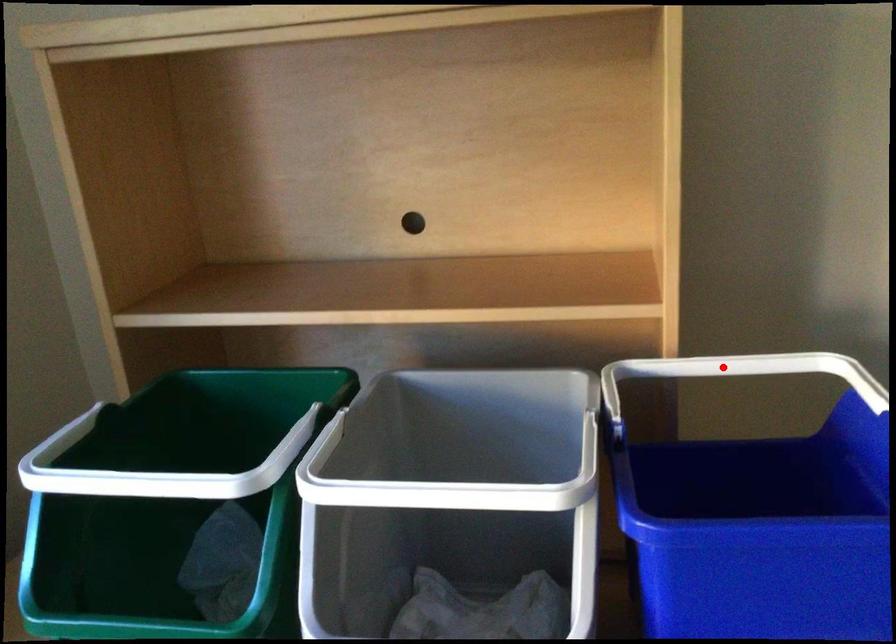
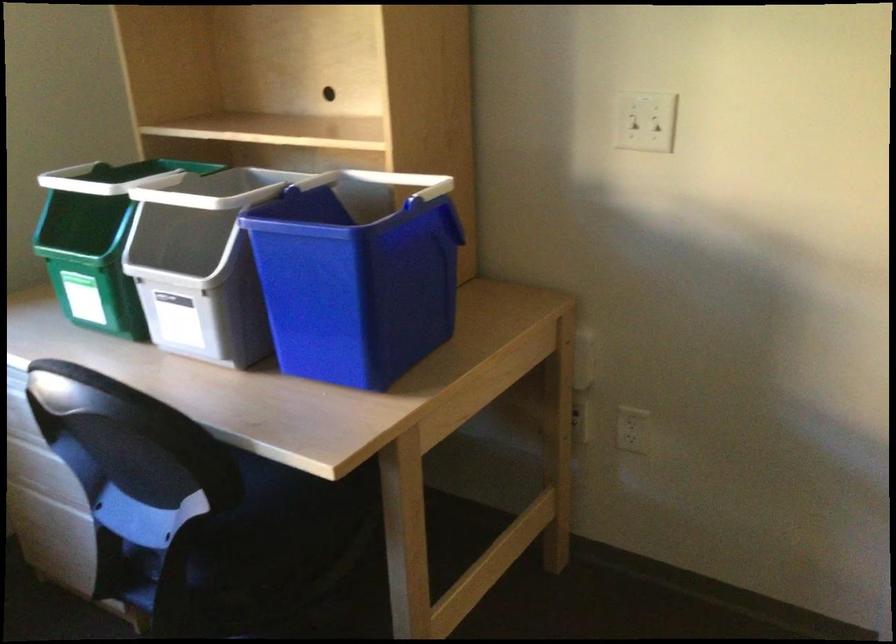
Locate, in the second image, the point that corresponds to the highlighted location in the first image.

(399, 181)